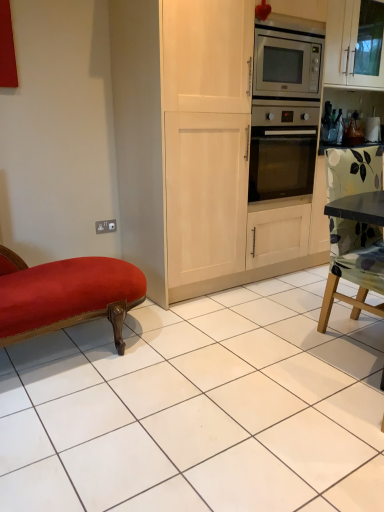
Describe the element at coordinates (355, 282) in the screenshot. Image resolution: width=384 pixels, height=512 pixels. I see `floral fabric chair at right` at that location.

Measure the distance between point (x=332, y=206) and camera.

1.80 meters.

Measure the distance between floral fabric chair at right and camera.

They are 5.46 feet apart.

At what (x,y) coordinates should I click in order to perform the action: click on floral fabric chair at right. Please return your answer as a coordinate pair (x, y). Looking at the image, I should click on (355, 282).

At what (x,y) coordinates should I click in order to perform the action: click on floral fabric chair at right. Please return your answer as a coordinate pair (x, y). Looking at the image, I should click on (355, 282).